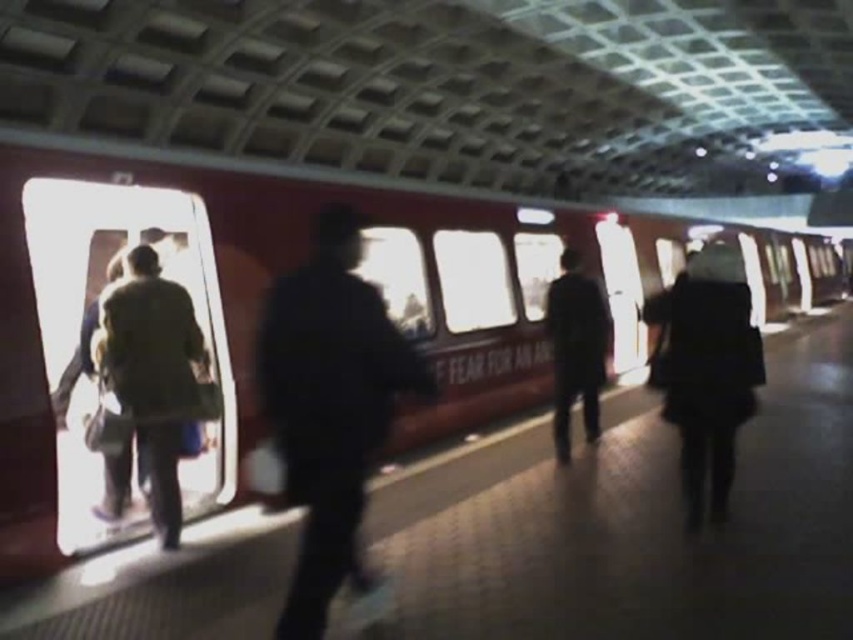
Question: Which object is the farthest from the dark green fabric jacket at right?

Choices:
 (A) red glossy train at center
 (B) dark blue jacket at center

Answer: (A)

Question: Observing the image, what is the correct spatial positioning of dark blue uniform at center in reference to dark blue jacket at center?

Choices:
 (A) above
 (B) below

Answer: (B)

Question: Which point is closer to the camera taking this photo?

Choices:
 (A) (735, 284)
 (B) (149, 410)

Answer: (B)

Question: Is green fabric coat at left positioned before dark blue jacket at center?

Choices:
 (A) no
 (B) yes

Answer: (B)

Question: Which of the following is the closest to the observer?

Choices:
 (A) dark blue uniform at center
 (B) dark green fabric jacket at right
 (C) dark blue jacket at center
 (D) green fabric coat at left

Answer: (A)

Question: Is green fabric coat at left further to camera compared to dark blue jacket at center?

Choices:
 (A) no
 (B) yes

Answer: (A)